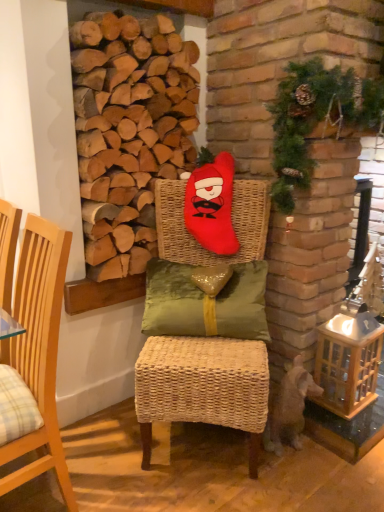
Describe the element at coordinates (37, 355) in the screenshot. This screenshot has height=512, width=384. I see `light wood chair at left, the second chair in the right-to-left sequence` at that location.

In the scene shown: Measure the distance between wooden lantern at lower right and camera.

The depth of wooden lantern at lower right is 5.68 feet.

This screenshot has width=384, height=512. What do you see at coordinates (289, 407) in the screenshot? I see `brown furry dog at lower right` at bounding box center [289, 407].

The width and height of the screenshot is (384, 512). What do you see at coordinates (316, 118) in the screenshot? I see `green textured wreath at upper right` at bounding box center [316, 118].

What do you see at coordinates (169, 297) in the screenshot? This screenshot has height=512, width=384. I see `green satin pillow at center` at bounding box center [169, 297].

At what (x,y) coordinates should I click in order to perform the action: click on green satin pillow at center. Please return your answer as a coordinate pair (x, y). Image resolution: width=384 pixels, height=512 pixels. Looking at the image, I should click on (169, 297).

Find the location of a particular element. The image size is (384, 512). red plush santa at center is located at coordinates (212, 205).

The width and height of the screenshot is (384, 512). What do you see at coordinates (212, 205) in the screenshot?
I see `red plush santa at center` at bounding box center [212, 205].

Describe the element at coordinates (202, 387) in the screenshot. I see `matte red plush at center, which is the 1th chair from right to left` at that location.

What are the coordinates of `light wood chair at left, which appears as the 1th chair when viewed from the left` in the screenshot? It's located at (37, 355).

What's the angular difference between brown furry dog at lower right and matte red plush at center, which is the 1th chair from right to left,'s facing directions?

brown furry dog at lower right and matte red plush at center, which is the 1th chair from right to left, are facing 50.1 degrees away from each other.

Where is `animal located on the right of matte red plush at center, which is the 1th chair from right to left`? Image resolution: width=384 pixels, height=512 pixels. animal located on the right of matte red plush at center, which is the 1th chair from right to left is located at coordinates (289, 407).

From the image's perspective, is brown furry dog at lower right above or below matte red plush at center, which is the 1th chair from right to left?

Clearly, from the image's perspective, brown furry dog at lower right is below matte red plush at center, which is the 1th chair from right to left.

Consider the image. Can you confirm if brown furry dog at lower right is wider than matte red plush at center, the second chair from the left?

No, brown furry dog at lower right is not wider than matte red plush at center, the second chair from the left.

Is light wood chair at left, which appears as the 1th chair when viewed from the left, shorter than green textured wreath at upper right?

No, light wood chair at left, which appears as the 1th chair when viewed from the left, is not shorter than green textured wreath at upper right.

Between light wood chair at left, which appears as the 1th chair when viewed from the left, and green textured wreath at upper right, which one has smaller size?

With smaller size is light wood chair at left, which appears as the 1th chair when viewed from the left.

From a real-world perspective, is green satin pillow at center on wooden lantern at lower right?

Yes.

The height and width of the screenshot is (512, 384). Find the location of `basket located below the green satin pillow at center (from the image's perspective)`. basket located below the green satin pillow at center (from the image's perspective) is located at coordinates (348, 362).

Looking at the image, does green satin pillow at center seem bigger or smaller compared to wooden lantern at lower right?

Considering their sizes, green satin pillow at center takes up more space than wooden lantern at lower right.

Considering the relative sizes of green satin pillow at center and wooden lantern at lower right in the image provided, is green satin pillow at center thinner than wooden lantern at lower right?

In fact, green satin pillow at center might be wider than wooden lantern at lower right.

Find the location of a particular element. This screenshot has width=384, height=512. christmas decoration located above the wooden lantern at lower right (from the image's perspective) is located at coordinates (316, 118).

In the scene shown: Is wooden lantern at lower right taller or shorter than green textured wreath at upper right?

In the image, wooden lantern at lower right appears to be shorter than green textured wreath at upper right.

From the picture: Is wooden lantern at lower right wider or thinner than green textured wreath at upper right?

wooden lantern at lower right is thinner than green textured wreath at upper right.

Between wooden lantern at lower right and green textured wreath at upper right, which one is positioned in front?

green textured wreath at upper right is closer to the camera.

This screenshot has width=384, height=512. In order to click on santa claus that is above the wooden lantern at lower right (from the image's perspective) in this screenshot , I will do `click(212, 205)`.

Is red plush santa at center next to wooden lantern at lower right and touching it?

red plush santa at center and wooden lantern at lower right are not in contact.

Can you confirm if red plush santa at center is taller than wooden lantern at lower right?

No, red plush santa at center is not taller than wooden lantern at lower right.

Is green textured wreath at upper right facing towards red plush santa at center?

No.

In the scene shown: Considering the positions of objects green textured wreath at upper right and red plush santa at center in the image provided, who is in front, green textured wreath at upper right or red plush santa at center?

green textured wreath at upper right is closer to the camera.

Between green textured wreath at upper right and red plush santa at center, which one has larger width?

green textured wreath at upper right.

From a real-world perspective, is brown furry dog at lower right above or below light wood chair at left, the second chair in the right-to-left sequence?

In terms of real-world spatial position, brown furry dog at lower right is below light wood chair at left, the second chair in the right-to-left sequence.

From the image's perspective, is brown furry dog at lower right located above light wood chair at left, the second chair in the right-to-left sequence?

No, from the image's perspective, brown furry dog at lower right is not above light wood chair at left, the second chair in the right-to-left sequence.

Is brown furry dog at lower right behind light wood chair at left, which appears as the 1th chair when viewed from the left?

Yes, it is behind light wood chair at left, which appears as the 1th chair when viewed from the left.

Is brown furry dog at lower right far from light wood chair at left, the second chair in the right-to-left sequence?

No, brown furry dog at lower right is not far from light wood chair at left, the second chair in the right-to-left sequence.

The height and width of the screenshot is (512, 384). I want to click on the 1st chair in front of the brown furry dog at lower right, starting your count from the anchor, so click(x=202, y=387).

This screenshot has width=384, height=512. What are the coordinates of `christmas decoration above the light wood chair at left, which appears as the 1th chair when viewed from the left (from a real-world perspective)` in the screenshot? It's located at (316, 118).

Considering their positions, is light wood chair at left, the second chair in the right-to-left sequence, positioned further to red plush santa at center than brown furry dog at lower right?

light wood chair at left, the second chair in the right-to-left sequence, lies further to red plush santa at center than the other object.

Looking at the image, which one is located further to red plush santa at center, brown furry dog at lower right or wooden lantern at lower right?

brown furry dog at lower right is further to red plush santa at center.

Estimate the real-world distances between objects in this image. Which object is closer to green textured wreath at upper right, wooden lantern at lower right or matte red plush at center, the second chair from the left?

Based on the image, wooden lantern at lower right appears to be nearer to green textured wreath at upper right.

Looking at the image, which one is located closer to brown furry dog at lower right, green textured wreath at upper right or wooden lantern at lower right?

wooden lantern at lower right.

Considering their positions, is matte red plush at center, the second chair from the left, positioned further to red plush santa at center than wooden lantern at lower right?

wooden lantern at lower right.

From the image, which object appears to be nearer to light wood chair at left, the second chair in the right-to-left sequence, green textured wreath at upper right or matte red plush at center, which is the 1th chair from right to left?

matte red plush at center, which is the 1th chair from right to left, is closer to light wood chair at left, the second chair in the right-to-left sequence.

Which object lies further to the anchor point green textured wreath at upper right, brown furry dog at lower right or light wood chair at left, the second chair in the right-to-left sequence?

Among the two, light wood chair at left, the second chair in the right-to-left sequence, is located further to green textured wreath at upper right.

Based on their spatial positions, is matte red plush at center, which is the 1th chair from right to left, or light wood chair at left, the second chair in the right-to-left sequence, closer to brown furry dog at lower right?

The object closer to brown furry dog at lower right is matte red plush at center, which is the 1th chair from right to left.

Where is `pillow between light wood chair at left, the second chair in the right-to-left sequence, and brown furry dog at lower right, in the horizontal direction`? pillow between light wood chair at left, the second chair in the right-to-left sequence, and brown furry dog at lower right, in the horizontal direction is located at coordinates (169, 297).

Identify the location of santa claus between green satin pillow at center and green textured wreath at upper right from left to right. Image resolution: width=384 pixels, height=512 pixels. (212, 205).

Where is `santa claus situated between light wood chair at left, which appears as the 1th chair when viewed from the left, and brown furry dog at lower right from left to right`? This screenshot has width=384, height=512. santa claus situated between light wood chair at left, which appears as the 1th chair when viewed from the left, and brown furry dog at lower right from left to right is located at coordinates (212, 205).

This screenshot has width=384, height=512. I want to click on chair situated between light wood chair at left, which appears as the 1th chair when viewed from the left, and red plush santa at center from left to right, so click(202, 387).